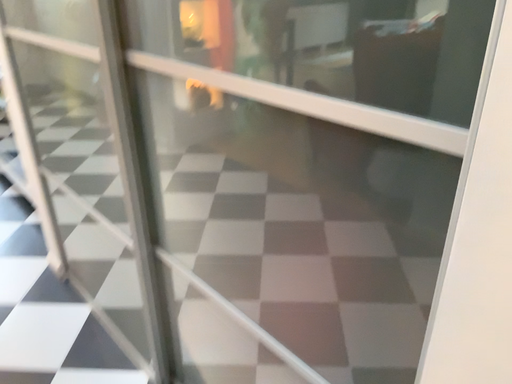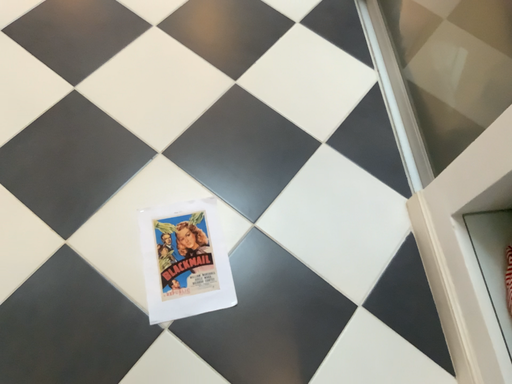
Question: Which way did the camera rotate in the video?

Choices:
 (A) rotated upward
 (B) rotated downward

Answer: (B)